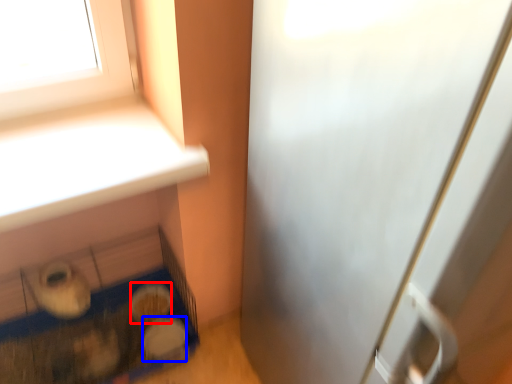
Question: Among these objects, which one is farthest to the camera, food (highlighted by a red box) or food (highlighted by a blue box)?

Choices:
 (A) food
 (B) food

Answer: (A)